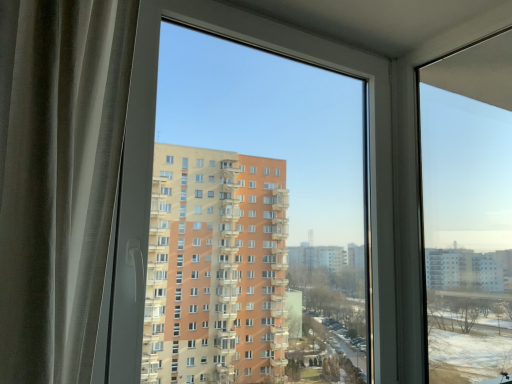
Question: From a real-world perspective, is transparent plastic window at center physically below transparent glass window at right?

Choices:
 (A) no
 (B) yes

Answer: (B)

Question: Could you tell me if transparent plastic window at center is turned towards transparent glass window at right?

Choices:
 (A) no
 (B) yes

Answer: (B)

Question: Is transparent plastic window at center outside of transparent glass window at right?

Choices:
 (A) no
 (B) yes

Answer: (B)

Question: From a real-world perspective, does transparent plastic window at center stand above transparent glass window at right?

Choices:
 (A) yes
 (B) no

Answer: (B)

Question: Considering the relative sizes of transparent plastic window at center and transparent glass window at right in the image provided, is transparent plastic window at center shorter than transparent glass window at right?

Choices:
 (A) yes
 (B) no

Answer: (B)

Question: Is there a large distance between transparent plastic window at center and transparent glass window at right?

Choices:
 (A) yes
 (B) no

Answer: (B)

Question: Considering the relative sizes of transparent glass window at right and transparent plastic window at center in the image provided, is transparent glass window at right bigger than transparent plastic window at center?

Choices:
 (A) no
 (B) yes

Answer: (A)

Question: Is transparent glass window at right with transparent plastic window at center?

Choices:
 (A) yes
 (B) no

Answer: (B)

Question: Is transparent glass window at right taller than transparent plastic window at center?

Choices:
 (A) yes
 (B) no

Answer: (B)

Question: From the image's perspective, is transparent glass window at right below transparent plastic window at center?

Choices:
 (A) yes
 (B) no

Answer: (A)

Question: Is transparent glass window at right facing away from transparent plastic window at center?

Choices:
 (A) no
 (B) yes

Answer: (A)

Question: Does transparent glass window at right have a smaller size compared to transparent plastic window at center?

Choices:
 (A) yes
 (B) no

Answer: (A)

Question: Considering the positions of transparent glass window at right and transparent plastic window at center in the image, is transparent glass window at right taller or shorter than transparent plastic window at center?

Choices:
 (A) short
 (B) tall

Answer: (A)